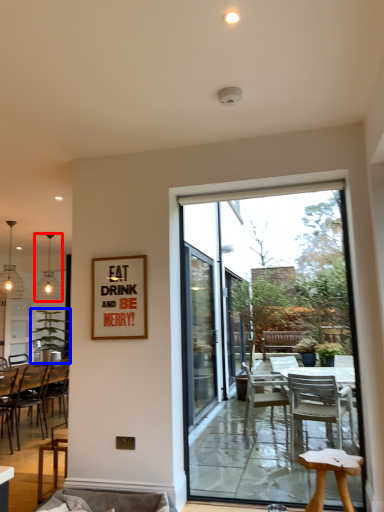
Question: Which object appears farthest to the camera in this image, lamp (highlighted by a red box) or houseplant (highlighted by a blue box)?

Choices:
 (A) lamp
 (B) houseplant

Answer: (A)